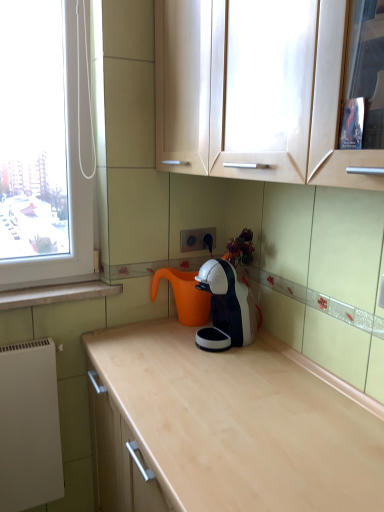
This screenshot has width=384, height=512. Describe the element at coordinates (216, 297) in the screenshot. I see `white glossy coffee machine at center` at that location.

Measure the distance between white matte radiator at lower left and camera.

white matte radiator at lower left and camera are 1.38 meters apart from each other.

What do you see at coordinates (57, 294) in the screenshot? This screenshot has height=512, width=384. I see `white marble window sill at lower left` at bounding box center [57, 294].

What is the approximate width of white marble window sill at lower left?

white marble window sill at lower left is 5.09 inches wide.

This screenshot has width=384, height=512. What do you see at coordinates (197, 239) in the screenshot? I see `white plastic electric outlet at center` at bounding box center [197, 239].

This screenshot has width=384, height=512. Find the location of `matte wood cabinets at upper center`. matte wood cabinets at upper center is located at coordinates [x=227, y=97].

Are white matte radiator at lower left and white marble window sill at lower left far apart?

No.

How different are the orientations of white matte radiator at lower left and white marble window sill at lower left in degrees?

The facing directions of white matte radiator at lower left and white marble window sill at lower left are 0.52 degrees apart.

From the image's perspective, which is above, white matte radiator at lower left or white marble window sill at lower left?

From the image's view, white marble window sill at lower left is above.

Considering the relative positions of white matte radiator at lower left and white marble window sill at lower left in the image provided, is white matte radiator at lower left to the right of white marble window sill at lower left from the viewer's perspective?

No.

From the image's perspective, is white marble window sill at lower left located above or below white glossy coffee machine at center?

white marble window sill at lower left is situated lower than white glossy coffee machine at center in the image.

Is white marble window sill at lower left positioned far away from white glossy coffee machine at center?

That's not correct — white marble window sill at lower left is a little close to white glossy coffee machine at center.

Can you tell me how much white marble window sill at lower left and white glossy coffee machine at center differ in facing direction?

There is a 95.1-degree angle between the facing directions of white marble window sill at lower left and white glossy coffee machine at center.

Can you confirm if matte wood cabinets at upper center is shorter than white marble window sill at lower left?

In fact, matte wood cabinets at upper center may be taller than white marble window sill at lower left.

Is matte wood cabinets at upper center bigger or smaller than white marble window sill at lower left?

Considering their sizes, matte wood cabinets at upper center takes up more space than white marble window sill at lower left.

Which object is thinner, matte wood cabinets at upper center or white marble window sill at lower left?

With smaller width is white marble window sill at lower left.

Where is `cabinetry in front of the white marble window sill at lower left`? cabinetry in front of the white marble window sill at lower left is located at coordinates (227, 97).

From a real-world perspective, between white glossy coffee machine at center and white matte radiator at lower left, who is vertically lower?

From a 3D spatial view, white matte radiator at lower left is below.

From the picture: Between white glossy coffee machine at center and white matte radiator at lower left, which one appears on the right side from the viewer's perspective?

Positioned to the right is white glossy coffee machine at center.

Is white glossy coffee machine at center smaller than white matte radiator at lower left?

Correct, white glossy coffee machine at center occupies less space than white matte radiator at lower left.

Where is `appliance located underneath the white glossy coffee machine at center (from a real-world perspective)`? This screenshot has height=512, width=384. appliance located underneath the white glossy coffee machine at center (from a real-world perspective) is located at coordinates (29, 426).

Is point (255, 329) closer to camera compared to point (200, 232)?

Yes, point (255, 329) is closer to viewer.

Who is bigger, white glossy coffee machine at center or white plastic electric outlet at center?

With larger size is white glossy coffee machine at center.

Which is behind, point (216, 270) or point (87, 294)?

The point (87, 294) is farther.

From the image's perspective, is white glossy coffee machine at center located above or below white marble window sill at lower left?

Based on their image positions, white glossy coffee machine at center is located above white marble window sill at lower left.

You are a GUI agent. You are given a task and a screenshot of the screen. Output one action in this format:
    pyautogui.click(x=<x>, y=<y>)
    Task: Click on the window sill on the left of white glossy coffee machine at center
    
    Given the screenshot: What is the action you would take?
    pyautogui.click(x=57, y=294)

Is white glossy coffee machine at center completely or partially outside of white marble window sill at lower left?

Yes, white glossy coffee machine at center is not within white marble window sill at lower left.

Which is correct: white glossy coffee machine at center is inside white marble window sill at lower left, or outside of it?

white glossy coffee machine at center exists outside the volume of white marble window sill at lower left.

Is white glossy coffee machine at center oriented away from white marble window sill at lower left?

That's not correct — white glossy coffee machine at center is not looking away from white marble window sill at lower left.

Which is more to the left, white glossy coffee machine at center or white marble window sill at lower left?

From the viewer's perspective, white marble window sill at lower left appears more on the left side.

How different are the orientations of white glossy coffee machine at center and white marble window sill at lower left in degrees?

The angle between the facing direction of white glossy coffee machine at center and the facing direction of white marble window sill at lower left is 90.5 degrees.

Identify the location of window sill above the white matte radiator at lower left (from the image's perspective). (57, 294).

This screenshot has height=512, width=384. Identify the location of tea set below the white marble window sill at lower left (from a real-world perspective). (216, 297).

Based on their spatial positions, is white glossy coffee machine at center or white matte radiator at lower left further from white glossy coffee machine at center?

white matte radiator at lower left is further to white glossy coffee machine at center.

Considering their positions, is white marble window sill at lower left positioned further to white glossy coffee machine at center than matte wood cabinets at upper center?

matte wood cabinets at upper center is positioned further to the anchor white glossy coffee machine at center.

Based on the photo, considering their positions, is white plastic electric outlet at center positioned closer to white glossy coffee machine at center than white marble window sill at lower left?

white plastic electric outlet at center lies closer to white glossy coffee machine at center than the other object.

When comparing their distances from white marble window sill at lower left, does white glossy coffee machine at center or white glossy coffee machine at center seem further?

Based on the image, white glossy coffee machine at center appears to be further to white marble window sill at lower left.

Looking at the image, which one is located closer to white marble window sill at lower left, white glossy coffee machine at center or white plastic electric outlet at center?

white glossy coffee machine at center.

When comparing their distances from white matte radiator at lower left, does matte wood cabinets at upper center or white marble window sill at lower left seem closer?

Based on the image, white marble window sill at lower left appears to be nearer to white matte radiator at lower left.

Estimate the real-world distances between objects in this image. Which object is further from matte wood cabinets at upper center, white plastic electric outlet at center or white matte radiator at lower left?

The object further to matte wood cabinets at upper center is white matte radiator at lower left.

Looking at the image, which one is located closer to white marble window sill at lower left, white plastic electric outlet at center or white matte radiator at lower left?

The object closer to white marble window sill at lower left is white matte radiator at lower left.

Locate an element on the screen. home appliance between matte wood cabinets at upper center and white marble window sill at lower left along the z-axis is located at coordinates (228, 302).

Identify the location of tea set between white glossy coffee machine at center and white plastic electric outlet at center along the z-axis. This screenshot has width=384, height=512. (216, 297).

You are a GUI agent. You are given a task and a screenshot of the screen. Output one action in this format:
    pyautogui.click(x=<x>, y=<y>)
    Task: Click on the window sill between white matte radiator at lower left and white glossy coffee machine at center
    The image size is (384, 512).
    Given the screenshot: What is the action you would take?
    pyautogui.click(x=57, y=294)

Where is `home appliance between matte wood cabinets at upper center and white glossy coffee machine at center from front to back`? The height and width of the screenshot is (512, 384). home appliance between matte wood cabinets at upper center and white glossy coffee machine at center from front to back is located at coordinates (228, 302).